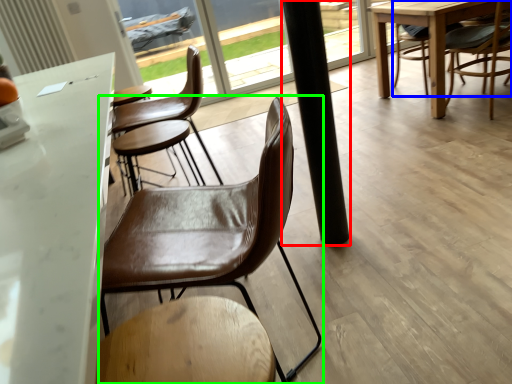
Question: Which is nearer to the pillar (highlighted by a red box)? chair (highlighted by a blue box) or chair (highlighted by a green box).

Choices:
 (A) chair
 (B) chair

Answer: (B)